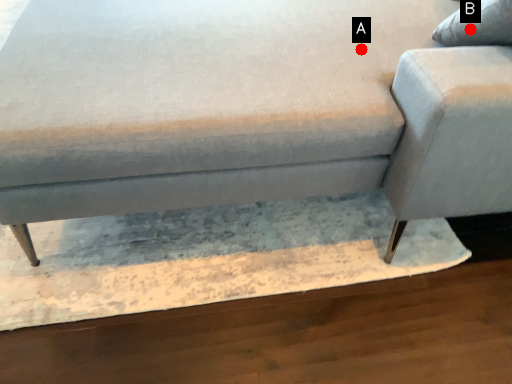
Question: Two points are circled on the image, labeled by A and B beside each circle. Which of the following is the farthest from the observer?

Choices:
 (A) A is further
 (B) B is further

Answer: (A)